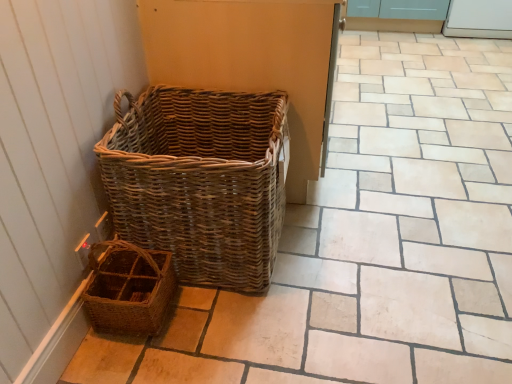
Question: From a real-world perspective, is white glossy screen door at upper right above or below natural wicker picnic basket at left, which is the first picnic basket in top-to-bottom order?

Choices:
 (A) above
 (B) below

Answer: (B)

Question: Considering the positions of point (499, 16) and point (242, 152), is point (499, 16) closer or farther from the camera than point (242, 152)?

Choices:
 (A) farther
 (B) closer

Answer: (A)

Question: Based on their relative distances, which object is nearer to the brown woven picnic basket at lower left, the second picnic basket in the top-to-bottom sequence?

Choices:
 (A) natural wicker picnic basket at left, which is the first picnic basket in top-to-bottom order
 (B) white glossy screen door at upper right

Answer: (A)

Question: Which of these objects is positioned farthest from the white glossy screen door at upper right?

Choices:
 (A) brown woven picnic basket at lower left, acting as the 1th picnic basket starting from the bottom
 (B) natural wicker picnic basket at left, placed as the second picnic basket when sorted from bottom to top

Answer: (A)